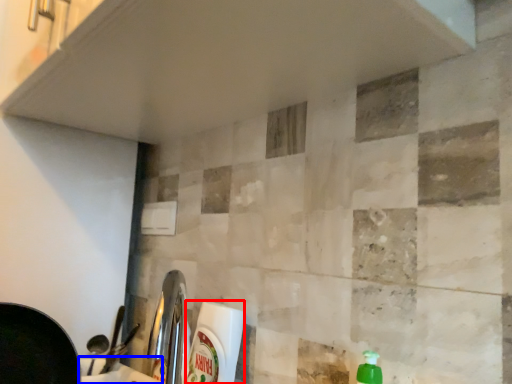
Question: Which object is closer to the camera taking this photo, cleaning product (highlighted by a red box) or counter top (highlighted by a blue box)?

Choices:
 (A) cleaning product
 (B) counter top

Answer: (B)